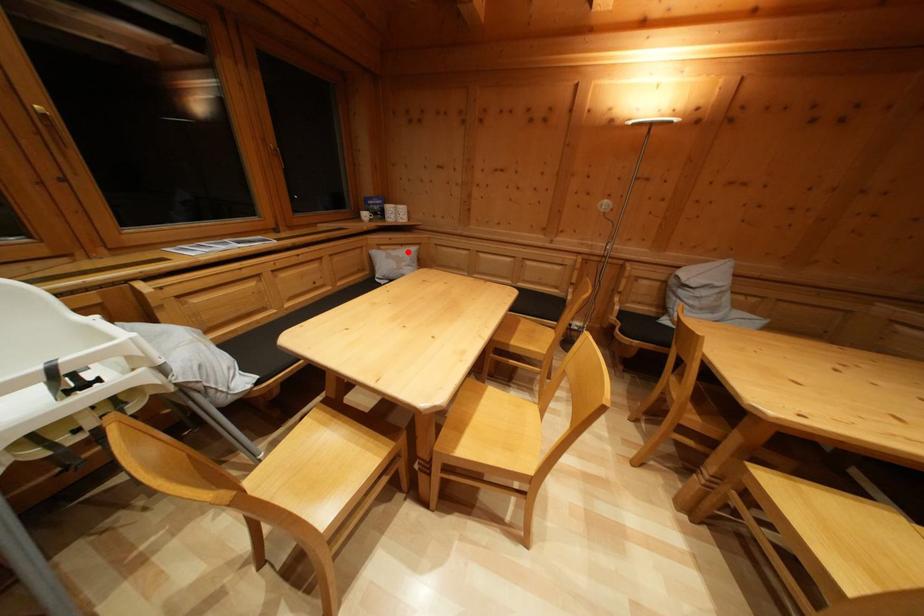
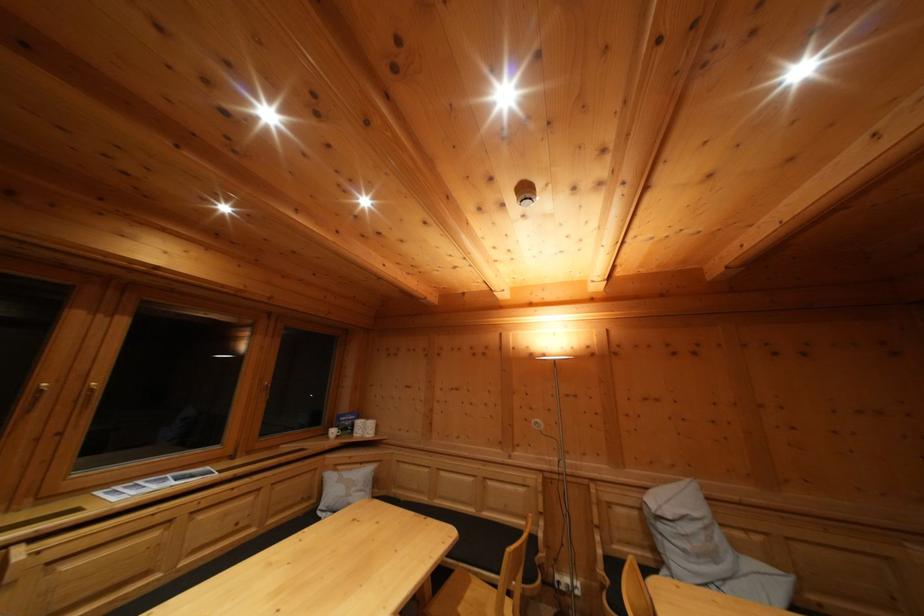
Question: A red point is marked in image1. In image2, is the corresponding 3D point closer to the camera or farther? Reply with the corresponding letter.

Choices:
 (A) The corresponding 3D point is closer.
 (B) The corresponding 3D point is farther.

Answer: (B)